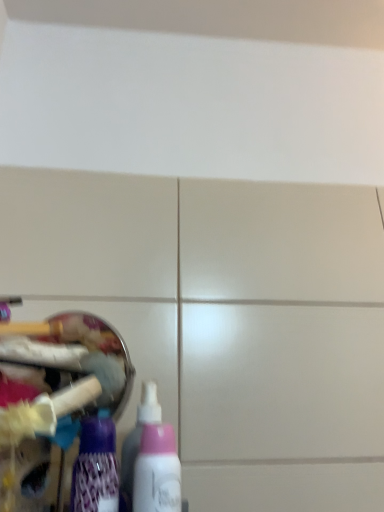
Question: Should I look upward or downward to see purple glossy bottle at lower left, positioned as the 1th bottle in left-to-right order?

Choices:
 (A) down
 (B) up

Answer: (A)

Question: Is purple glossy bottle at lower left, positioned as the 1th bottle in left-to-right order, positioned in front of pink plastic bottle at lower left, which ranks as the 3th bottle in left-to-right order?

Choices:
 (A) no
 (B) yes

Answer: (A)

Question: From the image's perspective, is purple glossy bottle at lower left, the third bottle positioned from the right, beneath pink plastic bottle at lower left, which ranks as the 3th bottle in left-to-right order?

Choices:
 (A) yes
 (B) no

Answer: (B)

Question: Is purple glossy bottle at lower left, the third bottle positioned from the right, located outside pink plastic bottle at lower left, which ranks as the 3th bottle in left-to-right order?

Choices:
 (A) yes
 (B) no

Answer: (A)

Question: Is purple glossy bottle at lower left, positioned as the 1th bottle in left-to-right order, to the left of pink plastic bottle at lower left, the 1th bottle viewed from the right, from the viewer's perspective?

Choices:
 (A) no
 (B) yes

Answer: (B)

Question: From a real-world perspective, is purple glossy bottle at lower left, positioned as the 1th bottle in left-to-right order, physically above pink plastic bottle at lower left, the 1th bottle viewed from the right?

Choices:
 (A) yes
 (B) no

Answer: (A)

Question: Can you see purple glossy bottle at lower left, the third bottle positioned from the right, touching pink plastic bottle at lower left, the 1th bottle viewed from the right?

Choices:
 (A) no
 (B) yes

Answer: (B)

Question: Is pink matte bottle at lower left, the second bottle viewed from the left, positioned before purple glossy bottle at lower left, positioned as the 1th bottle in left-to-right order?

Choices:
 (A) yes
 (B) no

Answer: (B)

Question: Does pink matte bottle at lower left, the second bottle viewed from the left, have a lesser height compared to purple glossy bottle at lower left, the third bottle positioned from the right?

Choices:
 (A) no
 (B) yes

Answer: (A)

Question: Is pink matte bottle at lower left, placed as the second bottle when sorted from right to left, looking in the opposite direction of purple glossy bottle at lower left, positioned as the 1th bottle in left-to-right order?

Choices:
 (A) no
 (B) yes

Answer: (A)

Question: Could you tell me if pink matte bottle at lower left, placed as the second bottle when sorted from right to left, is turned towards purple glossy bottle at lower left, the third bottle positioned from the right?

Choices:
 (A) yes
 (B) no

Answer: (B)

Question: Is pink matte bottle at lower left, placed as the second bottle when sorted from right to left, at the left side of purple glossy bottle at lower left, the third bottle positioned from the right?

Choices:
 (A) no
 (B) yes

Answer: (A)

Question: From a real-world perspective, does pink matte bottle at lower left, the second bottle viewed from the left, sit lower than purple glossy bottle at lower left, the third bottle positioned from the right?

Choices:
 (A) no
 (B) yes

Answer: (A)

Question: Does pink plastic bottle at lower left, the 1th bottle viewed from the right, lie in front of purple glossy bottle at lower left, the third bottle positioned from the right?

Choices:
 (A) no
 (B) yes

Answer: (B)